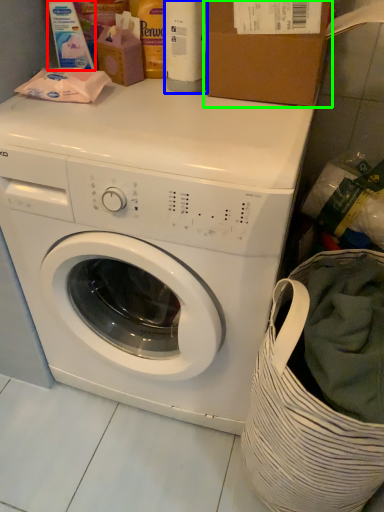
Question: Which is nearer to the cleaning product (highlighted by a red box)? cleaning product (highlighted by a blue box) or cardboard box (highlighted by a green box).

Choices:
 (A) cleaning product
 (B) cardboard box

Answer: (A)